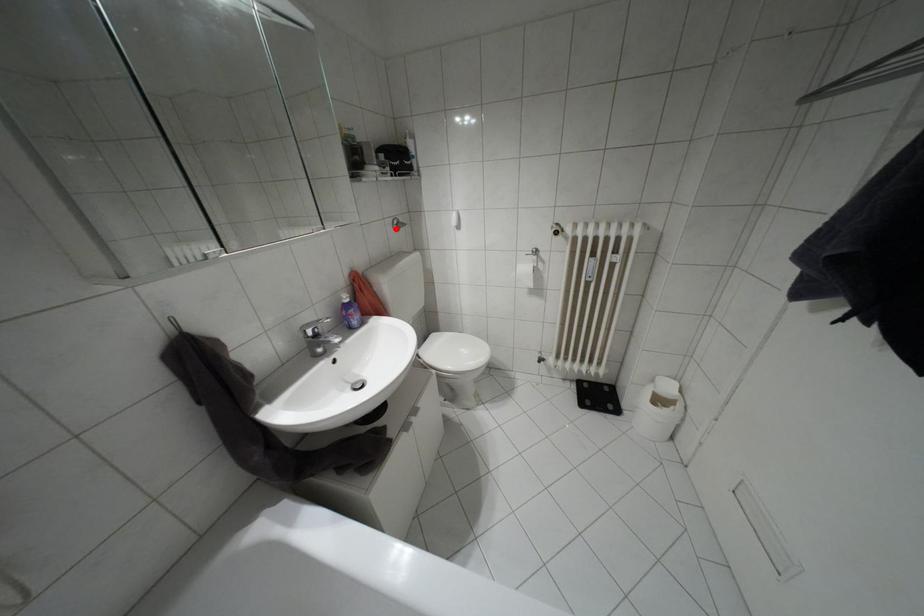
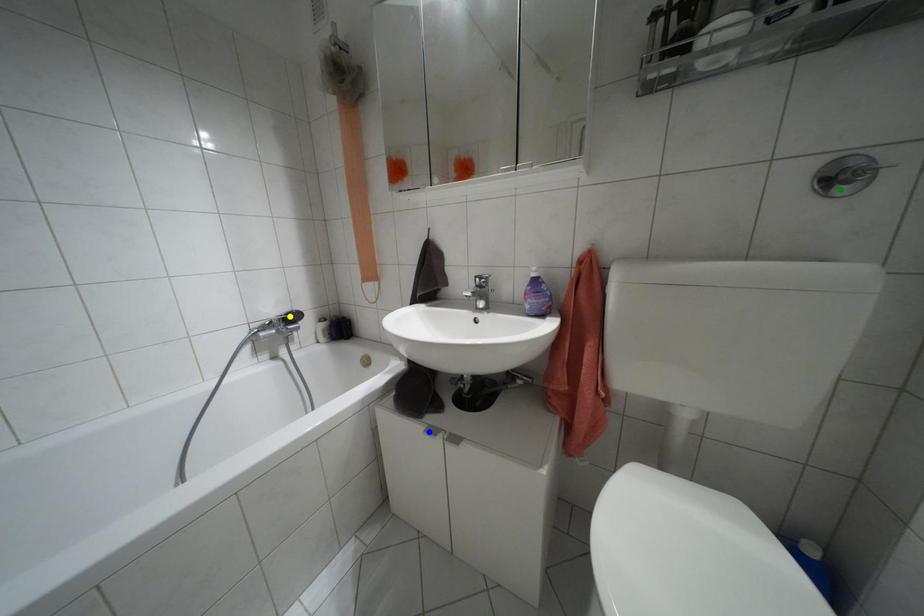
Question: I am providing you with two images of the same scene from different viewpoints. A red point is marked on the first image. You are given multiple points on the second image. Can you choose the point in image 2 that corresponds to the point in image 1?

Choices:
 (A) green point
 (B) yellow point
 (C) blue point

Answer: (A)